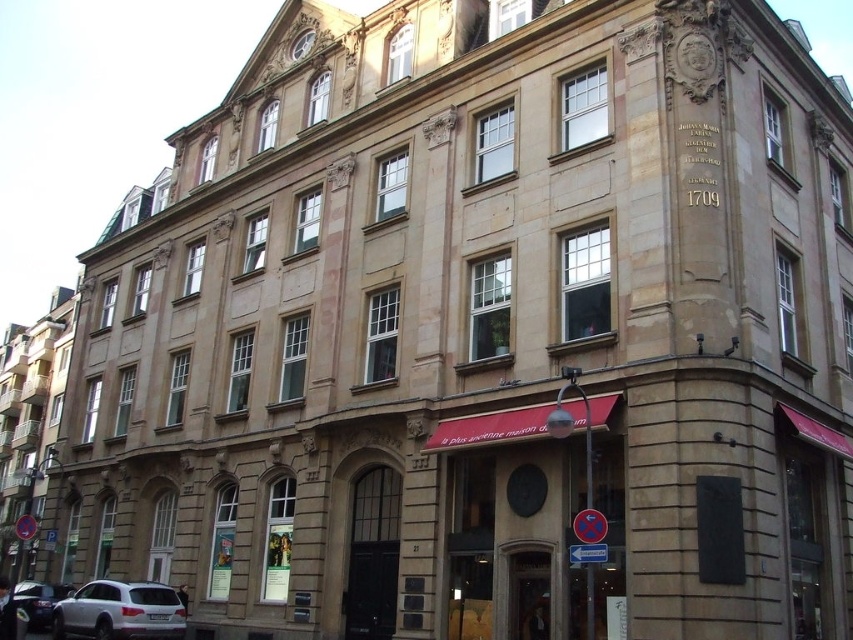
Does point (90, 582) lie in front of point (39, 593)?

No, (90, 582) is behind (39, 593).

Does white matte suv at lower left lie behind shiny silver car at lower left?

That is False.

Does point (84, 620) lie behind point (32, 604)?

No, (84, 620) is closer to viewer.

Locate an element on the screen. white matte suv at lower left is located at coordinates (119, 611).